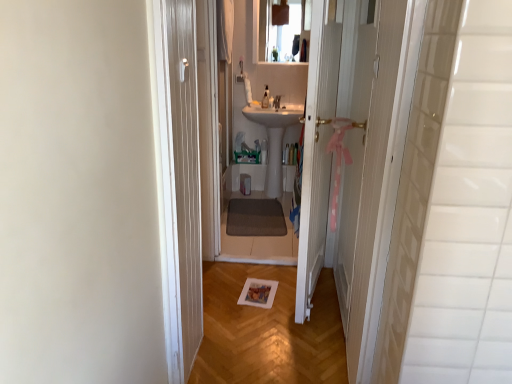
Question: From a real-world perspective, is white glossy sink at center located beneath clear glass mirror at upper center?

Choices:
 (A) no
 (B) yes

Answer: (B)

Question: Is white glossy sink at center directly adjacent to clear glass mirror at upper center?

Choices:
 (A) yes
 (B) no

Answer: (B)

Question: Is white glossy sink at center to the right of clear glass mirror at upper center from the viewer's perspective?

Choices:
 (A) yes
 (B) no

Answer: (B)

Question: Is white glossy sink at center closer to camera compared to clear glass mirror at upper center?

Choices:
 (A) yes
 (B) no

Answer: (A)

Question: Does white glossy sink at center have a larger size compared to clear glass mirror at upper center?

Choices:
 (A) no
 (B) yes

Answer: (B)

Question: Considering their positions, is white glossy sink at center located in front of or behind clear glass mirror at upper center?

Choices:
 (A) behind
 (B) front

Answer: (B)

Question: In terms of width, does white glossy sink at center look wider or thinner when compared to clear glass mirror at upper center?

Choices:
 (A) thin
 (B) wide

Answer: (B)

Question: From a real-world perspective, is white glossy sink at center above or below clear glass mirror at upper center?

Choices:
 (A) above
 (B) below

Answer: (B)

Question: Is point (271, 135) positioned closer to the camera than point (300, 34)?

Choices:
 (A) closer
 (B) farther

Answer: (B)

Question: Considering the positions of white wooden door at center and white glossy sink at center in the image, is white wooden door at center bigger or smaller than white glossy sink at center?

Choices:
 (A) small
 (B) big

Answer: (A)

Question: Looking at their shapes, would you say white wooden door at center is wider or thinner than white glossy sink at center?

Choices:
 (A) thin
 (B) wide

Answer: (A)

Question: Do you think white wooden door at center is within white glossy sink at center, or outside of it?

Choices:
 (A) inside
 (B) outside

Answer: (B)

Question: From a real-world perspective, relative to white glossy sink at center, is white wooden door at center vertically above or below?

Choices:
 (A) below
 (B) above

Answer: (B)

Question: Based on their sizes in the image, would you say white wooden door at center is bigger or smaller than clear glass mirror at upper center?

Choices:
 (A) small
 (B) big

Answer: (B)

Question: Considering the positions of point (316, 188) and point (268, 26), is point (316, 188) closer or farther from the camera than point (268, 26)?

Choices:
 (A) farther
 (B) closer

Answer: (B)